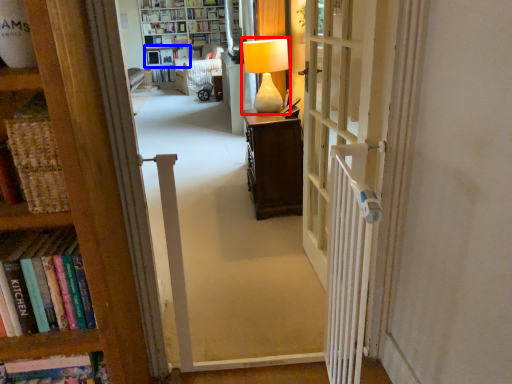
Question: Which object appears closest to the camera in this image, table lamp (highlighted by a red box) or shelf (highlighted by a blue box)?

Choices:
 (A) table lamp
 (B) shelf

Answer: (A)